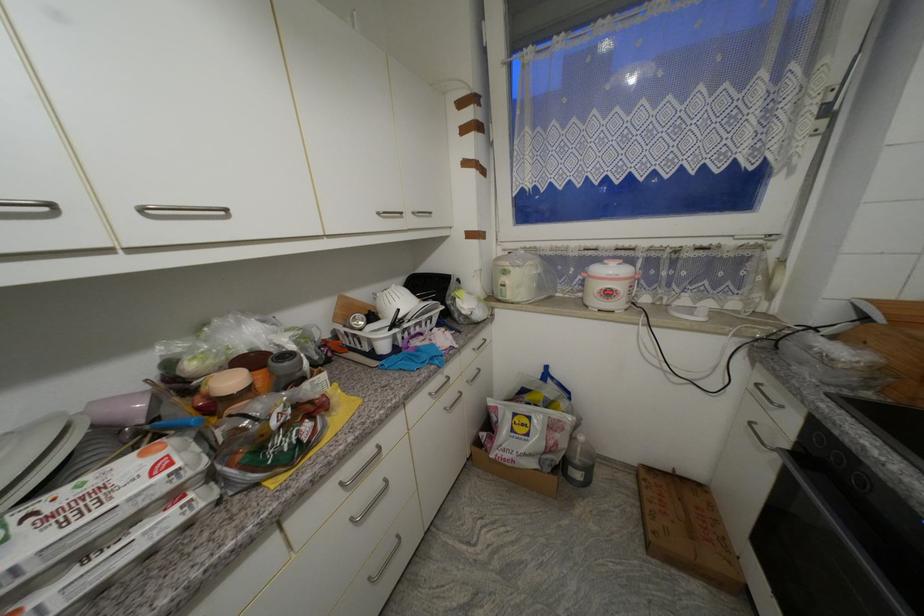
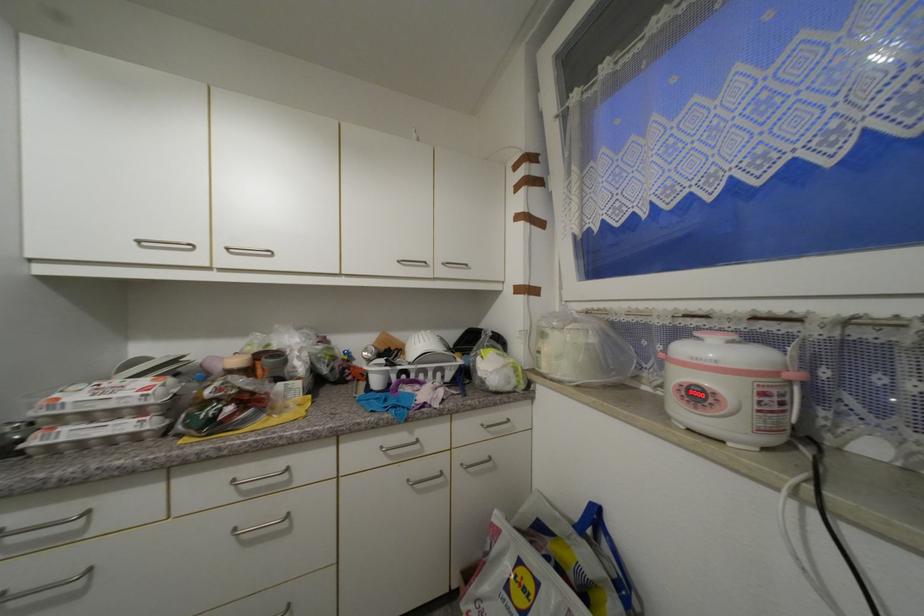
The point at [347,485] is marked in the first image. Where is the corresponding point in the second image?

(238, 483)